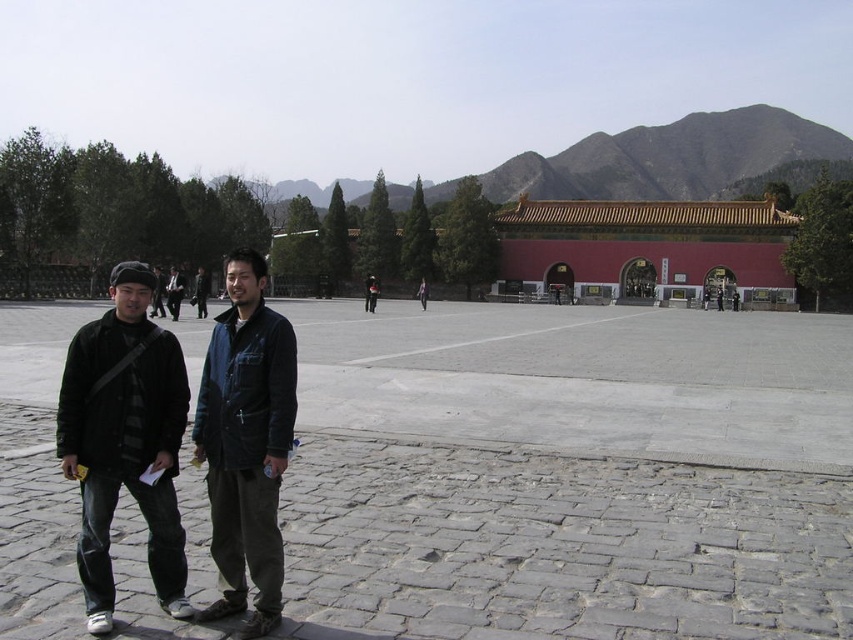
You are a photographer trying to capture a group photo of two people wearing black matte jackets. The black matte jacket at left and the matte black jacket at center are both in your frame. Based on their positions, which jacket is on the right side of the other?

The black matte jacket at left is positioned on the right side of matte black jacket at center, so the black matte jacket at left is on the right side of the matte black jacket at center.

You are planning to take a photo of the red matte building at center and the dark blue jacket at center. Based on their sizes, which one should appear larger in the photo?

The red matte building at center might be wider than dark blue jacket at center, so it should appear larger in the photo.

You are a photographer trying to capture a photo of both point (x=86, y=422) and point (x=163, y=308) in the scene. Which point should you focus on first to ensure both are in sharp focus?

You should focus on point (x=86, y=422) first because it is closer to the camera than point (x=163, y=308), ensuring the depth of field captures both points clearly.